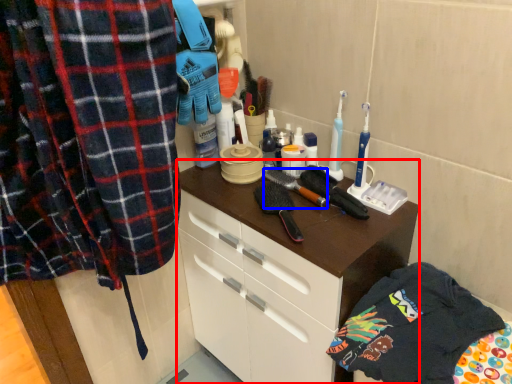
Question: Which object appears closest to the camera in this image, cabinetry (highlighted by a red box) or brush (highlighted by a blue box)?

Choices:
 (A) cabinetry
 (B) brush

Answer: (A)